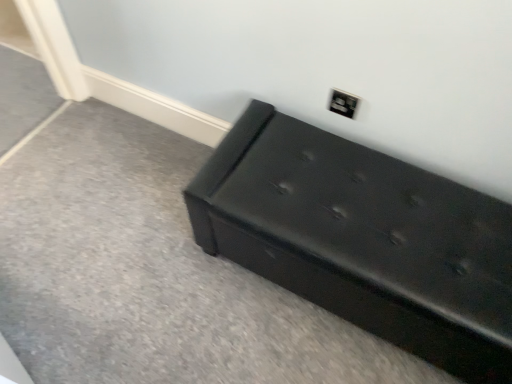
Question: From the image's perspective, is matte black outlet at upper right located above black leather bench at lower right?

Choices:
 (A) no
 (B) yes

Answer: (B)

Question: Can you confirm if matte black outlet at upper right is wider than black leather bench at lower right?

Choices:
 (A) no
 (B) yes

Answer: (A)

Question: Are matte black outlet at upper right and black leather bench at lower right far apart?

Choices:
 (A) yes
 (B) no

Answer: (B)

Question: Is matte black outlet at upper right positioned with its back to black leather bench at lower right?

Choices:
 (A) yes
 (B) no

Answer: (B)

Question: Considering the relative positions of matte black outlet at upper right and black leather bench at lower right in the image provided, is matte black outlet at upper right in front of black leather bench at lower right?

Choices:
 (A) no
 (B) yes

Answer: (A)

Question: Is matte black outlet at upper right at the left side of black leather bench at lower right?

Choices:
 (A) no
 (B) yes

Answer: (B)

Question: Could you tell me if black leather bench at lower right is turned towards matte black outlet at upper right?

Choices:
 (A) no
 (B) yes

Answer: (A)

Question: Is the position of black leather bench at lower right less distant than that of matte black outlet at upper right?

Choices:
 (A) yes
 (B) no

Answer: (A)

Question: Considering the relative sizes of black leather bench at lower right and matte black outlet at upper right in the image provided, is black leather bench at lower right taller than matte black outlet at upper right?

Choices:
 (A) no
 (B) yes

Answer: (B)

Question: Can you confirm if black leather bench at lower right is thinner than matte black outlet at upper right?

Choices:
 (A) no
 (B) yes

Answer: (A)

Question: Considering the relative sizes of black leather bench at lower right and matte black outlet at upper right in the image provided, is black leather bench at lower right shorter than matte black outlet at upper right?

Choices:
 (A) yes
 (B) no

Answer: (B)

Question: Considering the relative positions of black leather bench at lower right and matte black outlet at upper right in the image provided, is black leather bench at lower right to the right of matte black outlet at upper right from the viewer's perspective?

Choices:
 (A) no
 (B) yes

Answer: (B)

Question: Is black leather bench at lower right in front of or behind matte black outlet at upper right in the image?

Choices:
 (A) behind
 (B) front

Answer: (B)